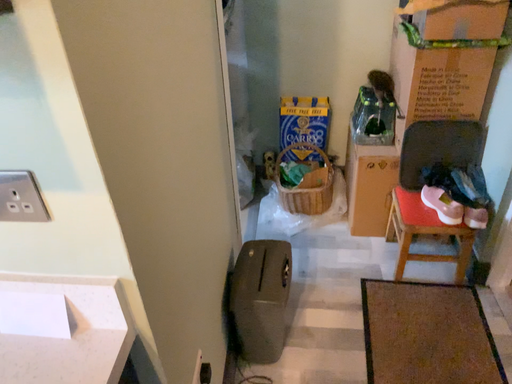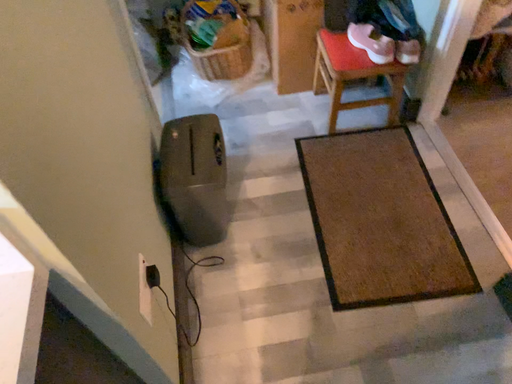
Question: How did the camera likely rotate when shooting the video?

Choices:
 (A) rotated left
 (B) rotated right

Answer: (B)